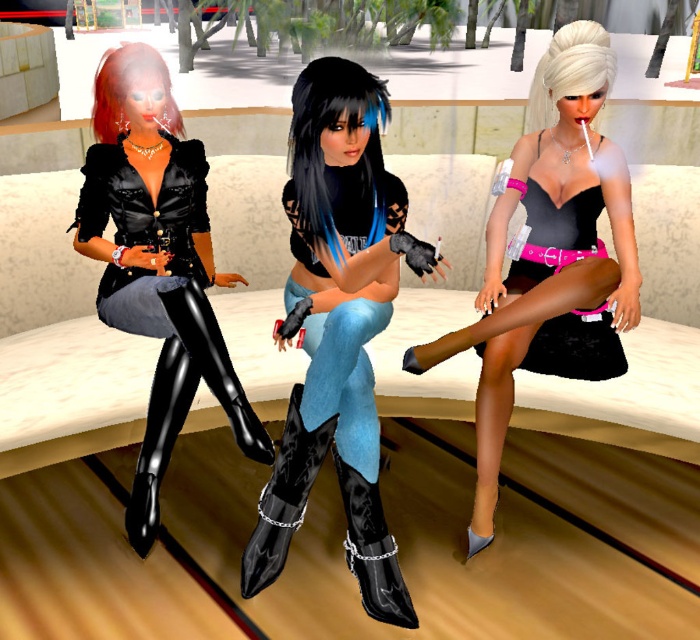
Is shiny black boots at left bigger than white silky hair at upper center?

Indeed, shiny black boots at left has a larger size compared to white silky hair at upper center.

Between point (206, 273) and point (556, 81), which one is positioned behind?

Positioned behind is point (206, 273).

Image resolution: width=700 pixels, height=640 pixels. I want to click on shiny black boots at left, so click(x=155, y=262).

From the picture: Who is more forward, (483, 518) or (570, 65)?

Point (570, 65)

Is matte black dress at center below white silky hair at upper center?

Yes, matte black dress at center is below white silky hair at upper center.

Is point (575, 284) closer to viewer compared to point (568, 49)?

That is True.

Identify the location of matte black dress at center. This screenshot has width=700, height=640. (550, 257).

Between glossy black boot at center and black leather boot at lower left, which one has less height?

black leather boot at lower left

Between point (330, 429) and point (238, 397), which one is positioned behind?

The point (238, 397) is more distant.

Where is `glossy black boot at center`? Image resolution: width=700 pixels, height=640 pixels. glossy black boot at center is located at coordinates (284, 497).